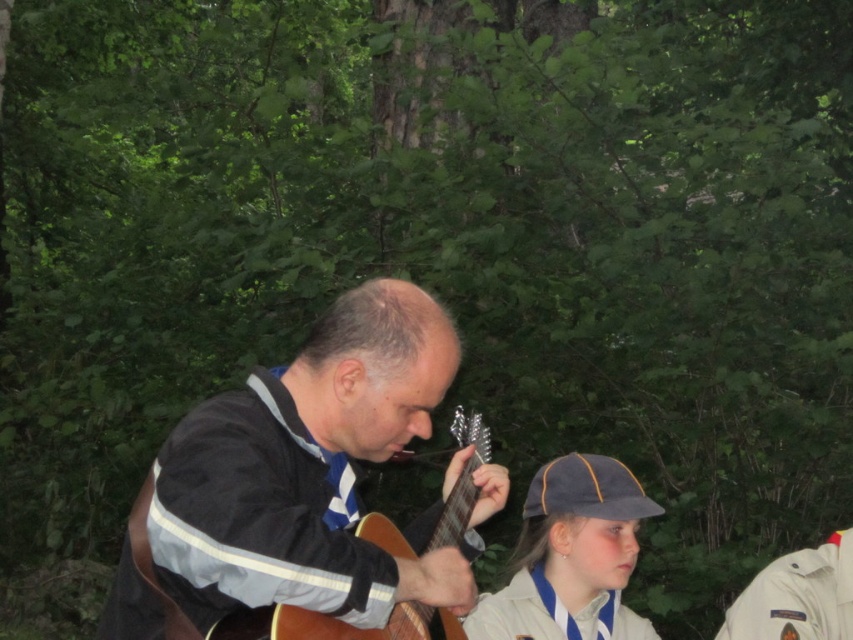
Question: Is white fabric uniform at right behind white fabric uniform at lower center?

Choices:
 (A) no
 (B) yes

Answer: (B)

Question: Does gray fabric cap at lower right appear on the left side of white fabric uniform at right?

Choices:
 (A) yes
 (B) no

Answer: (A)

Question: Which point is closer to the camera?

Choices:
 (A) white fabric uniform at lower center
 (B) gray fabric cap at lower right

Answer: (A)

Question: Which is nearer to the white fabric uniform at lower center?

Choices:
 (A) white fabric uniform at right
 (B) wooden acoustic guitar at center
 (C) black fabric jacket at center

Answer: (A)

Question: Considering the real-world distances, which object is farthest from the white fabric uniform at lower center?

Choices:
 (A) gray fabric cap at lower right
 (B) white fabric uniform at right
 (C) black fabric jacket at center
 (D) wooden acoustic guitar at center

Answer: (C)

Question: Does black fabric jacket at center have a greater width compared to gray fabric cap at lower right?

Choices:
 (A) yes
 (B) no

Answer: (A)